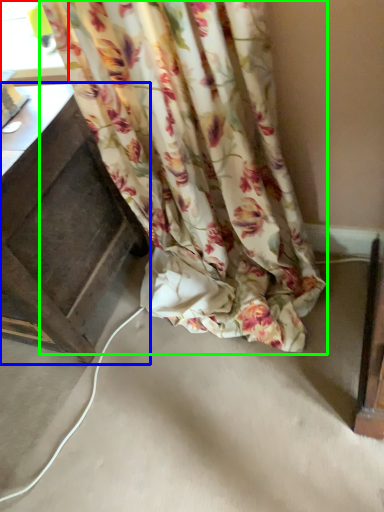
Question: Which is farther away from window (highlighted by a red box)? furniture (highlighted by a blue box) or curtain (highlighted by a green box)?

Choices:
 (A) furniture
 (B) curtain

Answer: (B)